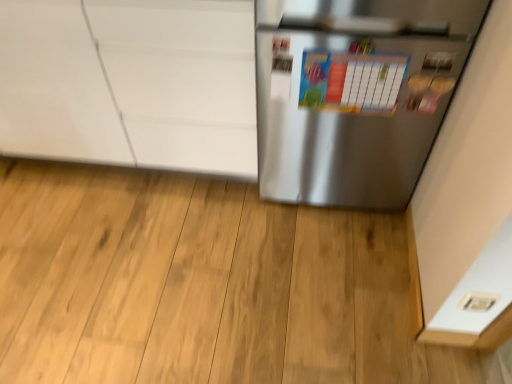
Question: Relative to colorful paperboard at center, is white plastic electric outlet at lower right in front or behind?

Choices:
 (A) behind
 (B) front

Answer: (B)

Question: From a real-world perspective, is white plastic electric outlet at lower right above or below colorful paperboard at center?

Choices:
 (A) above
 (B) below

Answer: (B)

Question: Estimate the real-world distances between objects in this image. Which object is farther from the colorful paperboard at center?

Choices:
 (A) satin silver refrigerator at right
 (B) white plastic electric outlet at lower right
 (C) white glossy cabinet at upper left

Answer: (B)

Question: Which is farther from the white glossy cabinet at upper left?

Choices:
 (A) colorful paperboard at center
 (B) satin silver refrigerator at right
 (C) white plastic electric outlet at lower right

Answer: (C)